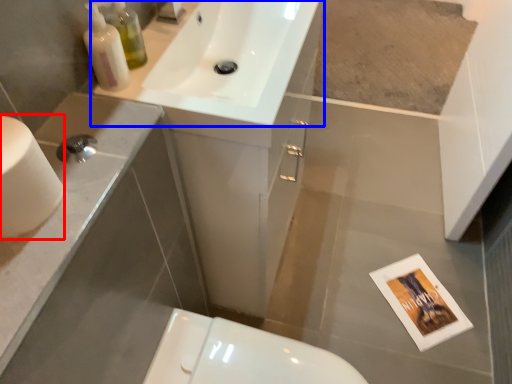
Question: Which of the following is the closest to the observer, toilet paper (highlighted by a red box) or sink (highlighted by a blue box)?

Choices:
 (A) toilet paper
 (B) sink

Answer: (A)